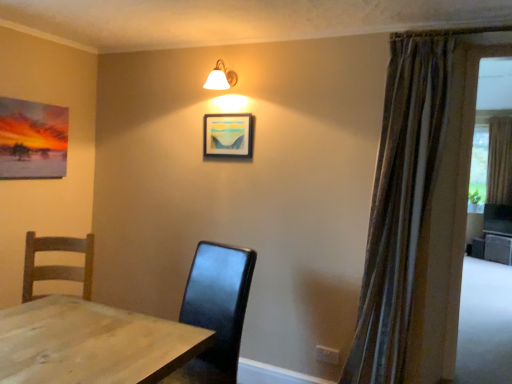
This screenshot has width=512, height=384. Describe the element at coordinates (499, 161) in the screenshot. I see `brown textured curtain at right, positioned as the first curtain in right-to-left order` at that location.

The image size is (512, 384). Identify the location of matte wooden picture frame at upper center. (228, 135).

Image resolution: width=512 pixels, height=384 pixels. What do you see at coordinates (228, 135) in the screenshot?
I see `matte wooden picture frame at upper center` at bounding box center [228, 135].

This screenshot has height=384, width=512. Describe the element at coordinates (399, 204) in the screenshot. I see `striped fabric curtain at right, marked as the first curtain in a left-to-right arrangement` at that location.

The width and height of the screenshot is (512, 384). What are the coordinates of `brown textured curtain at right, arranged as the 1th curtain when viewed from the back` in the screenshot? It's located at (499, 161).

From a real-world perspective, is white glass lamp at upper center located beneath striped fabric curtain at right, the second curtain from the back?

No.

Which object is thinner, white glass lamp at upper center or striped fabric curtain at right, the second curtain in the right-to-left sequence?

Thinner between the two is white glass lamp at upper center.

Does white glass lamp at upper center contain striped fabric curtain at right, the 1th curtain positioned from the front?

No, striped fabric curtain at right, the 1th curtain positioned from the front, is not surrounded by white glass lamp at upper center.

At what (x,y) coordinates should I click in order to perform the action: click on lamp that is behind the striped fabric curtain at right, the second curtain from the back. Please return your answer as a coordinate pair (x, y). This screenshot has width=512, height=384. Looking at the image, I should click on (221, 77).

Considering the positions of objects white glass lamp at upper center and matte wooden picture frame at upper center in the image provided, who is in front, white glass lamp at upper center or matte wooden picture frame at upper center?

Positioned in front is white glass lamp at upper center.

Between white glass lamp at upper center and matte wooden picture frame at upper center, which one appears on the left side from the viewer's perspective?

white glass lamp at upper center.

From a real-world perspective, between white glass lamp at upper center and matte wooden picture frame at upper center, who is vertically lower?

In real-world perspective, matte wooden picture frame at upper center is lower.

Is point (218, 83) closer or farther from the camera than point (206, 142)?

Clearly, point (218, 83) is closer to the camera than point (206, 142).

Which object is more forward, matte wooden picture frame at upper center or brown textured curtain at right, acting as the 2th curtain starting from the front?

matte wooden picture frame at upper center is in front.

From their relative heights in the image, would you say matte wooden picture frame at upper center is taller or shorter than brown textured curtain at right, positioned as the first curtain in right-to-left order?

In the image, matte wooden picture frame at upper center appears to be shorter than brown textured curtain at right, positioned as the first curtain in right-to-left order.

Consider the image. From the image's perspective, is matte wooden picture frame at upper center located above or below brown textured curtain at right, which is counted as the second curtain, starting from the left?

Based on their image positions, matte wooden picture frame at upper center is located beneath brown textured curtain at right, which is counted as the second curtain, starting from the left.

Considering the relative sizes of brown textured curtain at right, arranged as the 1th curtain when viewed from the back, and striped fabric curtain at right, the second curtain from the back, in the image provided, is brown textured curtain at right, arranged as the 1th curtain when viewed from the back, bigger than striped fabric curtain at right, the second curtain from the back,?

No.

Can you tell me how much brown textured curtain at right, acting as the 2th curtain starting from the front, and striped fabric curtain at right, the 1th curtain positioned from the front, differ in facing direction?

0.00205 degrees separate the facing orientations of brown textured curtain at right, acting as the 2th curtain starting from the front, and striped fabric curtain at right, the 1th curtain positioned from the front.

From a real-world perspective, which object stands above the other?

brown textured curtain at right, positioned as the first curtain in right-to-left order.

Could striped fabric curtain at right, marked as the first curtain in a left-to-right arrangement, be considered to be inside brown textured curtain at right, acting as the 2th curtain starting from the front?

No, striped fabric curtain at right, marked as the first curtain in a left-to-right arrangement, is located outside of brown textured curtain at right, acting as the 2th curtain starting from the front.

The image size is (512, 384). Find the location of `the 2nd curtain below the matte wooden picture frame at upper center (from a real-world perspective)`. the 2nd curtain below the matte wooden picture frame at upper center (from a real-world perspective) is located at coordinates (399, 204).

Measure the distance from striped fabric curtain at right, the second curtain from the back, to matte wooden picture frame at upper center.

striped fabric curtain at right, the second curtain from the back, is 3.62 feet from matte wooden picture frame at upper center.

In the image, is striped fabric curtain at right, marked as the first curtain in a left-to-right arrangement, on the left side or the right side of matte wooden picture frame at upper center?

Clearly, striped fabric curtain at right, marked as the first curtain in a left-to-right arrangement, is on the right of matte wooden picture frame at upper center in the image.

Between striped fabric curtain at right, the second curtain in the right-to-left sequence, and matte wooden picture frame at upper center, which one has larger size?

With larger size is striped fabric curtain at right, the second curtain in the right-to-left sequence.

Is matte wooden picture frame at upper center positioned with its back to white glass lamp at upper center?

matte wooden picture frame at upper center does not have its back to white glass lamp at upper center.

Which of these two, matte wooden picture frame at upper center or white glass lamp at upper center, is smaller?

matte wooden picture frame at upper center.

Is white glass lamp at upper center located within matte wooden picture frame at upper center?

Definitely not — white glass lamp at upper center is not inside matte wooden picture frame at upper center.

How many degrees apart are the facing directions of matte wooden picture frame at upper center and white glass lamp at upper center?

The angular difference between matte wooden picture frame at upper center and white glass lamp at upper center is 0.00643 degrees.

Does brown textured curtain at right, which is counted as the second curtain, starting from the left, touch white glass lamp at upper center?

No, brown textured curtain at right, which is counted as the second curtain, starting from the left, is not making contact with white glass lamp at upper center.

Is brown textured curtain at right, arranged as the 1th curtain when viewed from the back, in front of or behind white glass lamp at upper center in the image?

Clearly, brown textured curtain at right, arranged as the 1th curtain when viewed from the back, is behind white glass lamp at upper center.

Does brown textured curtain at right, positioned as the first curtain in right-to-left order, have a lesser width compared to white glass lamp at upper center?

Yes, brown textured curtain at right, positioned as the first curtain in right-to-left order, is thinner than white glass lamp at upper center.

This screenshot has height=384, width=512. I want to click on lamp lying in front of the brown textured curtain at right, positioned as the first curtain in right-to-left order, so click(221, 77).

The width and height of the screenshot is (512, 384). Find the location of `curtain that is the 2nd one below the white glass lamp at upper center (from a real-world perspective)`. curtain that is the 2nd one below the white glass lamp at upper center (from a real-world perspective) is located at coordinates click(x=399, y=204).

This screenshot has height=384, width=512. Identify the location of lamp on the left of matte wooden picture frame at upper center. (221, 77).

In the scene shown: Estimate the real-world distances between objects in this image. Which object is further from brown textured curtain at right, which is counted as the second curtain, starting from the left, striped fabric curtain at right, the 1th curtain positioned from the front, or white glass lamp at upper center?

The object further to brown textured curtain at right, which is counted as the second curtain, starting from the left, is white glass lamp at upper center.

Looking at the image, which one is located further to white glass lamp at upper center, brown textured curtain at right, acting as the 2th curtain starting from the front, or striped fabric curtain at right, marked as the first curtain in a left-to-right arrangement?

The object further to white glass lamp at upper center is brown textured curtain at right, acting as the 2th curtain starting from the front.

Which object lies nearer to the anchor point brown textured curtain at right, arranged as the 1th curtain when viewed from the back, white glass lamp at upper center or matte wooden picture frame at upper center?

matte wooden picture frame at upper center.

From the picture: Looking at the image, which one is located further to striped fabric curtain at right, the second curtain from the back, brown textured curtain at right, which is counted as the second curtain, starting from the left, or matte wooden picture frame at upper center?

Among the two, brown textured curtain at right, which is counted as the second curtain, starting from the left, is located further to striped fabric curtain at right, the second curtain from the back.

Looking at the image, which one is located further to striped fabric curtain at right, the second curtain in the right-to-left sequence, matte wooden picture frame at upper center or brown textured curtain at right, which is counted as the second curtain, starting from the left?

Based on the image, brown textured curtain at right, which is counted as the second curtain, starting from the left, appears to be further to striped fabric curtain at right, the second curtain in the right-to-left sequence.

Considering their positions, is matte wooden picture frame at upper center positioned further to white glass lamp at upper center than brown textured curtain at right, positioned as the first curtain in right-to-left order?

The object further to white glass lamp at upper center is brown textured curtain at right, positioned as the first curtain in right-to-left order.

Looking at the image, which one is located further to white glass lamp at upper center, striped fabric curtain at right, marked as the first curtain in a left-to-right arrangement, or brown textured curtain at right, acting as the 2th curtain starting from the front?

Among the two, brown textured curtain at right, acting as the 2th curtain starting from the front, is located further to white glass lamp at upper center.

When comparing their distances from matte wooden picture frame at upper center, does striped fabric curtain at right, marked as the first curtain in a left-to-right arrangement, or white glass lamp at upper center seem closer?

Based on the image, white glass lamp at upper center appears to be nearer to matte wooden picture frame at upper center.

You are a GUI agent. You are given a task and a screenshot of the screen. Output one action in this format:
    pyautogui.click(x=<x>, y=<y>)
    Task: Click on the picture frame located between striped fabric curtain at right, marked as the first curtain in a left-to-right arrangement, and brown textured curtain at right, arranged as the 1th curtain when viewed from the back, in the depth direction
    
    Given the screenshot: What is the action you would take?
    pyautogui.click(x=228, y=135)

I want to click on picture frame between white glass lamp at upper center and brown textured curtain at right, positioned as the first curtain in right-to-left order, from left to right, so click(x=228, y=135).

Find the location of `lamp positioned between striped fabric curtain at right, marked as the first curtain in a left-to-right arrangement, and brown textured curtain at right, acting as the 2th curtain starting from the front, from near to far`. lamp positioned between striped fabric curtain at right, marked as the first curtain in a left-to-right arrangement, and brown textured curtain at right, acting as the 2th curtain starting from the front, from near to far is located at coordinates (221, 77).

The height and width of the screenshot is (384, 512). What are the coordinates of `picture frame between white glass lamp at upper center and striped fabric curtain at right, the second curtain from the back` in the screenshot? It's located at [x=228, y=135].